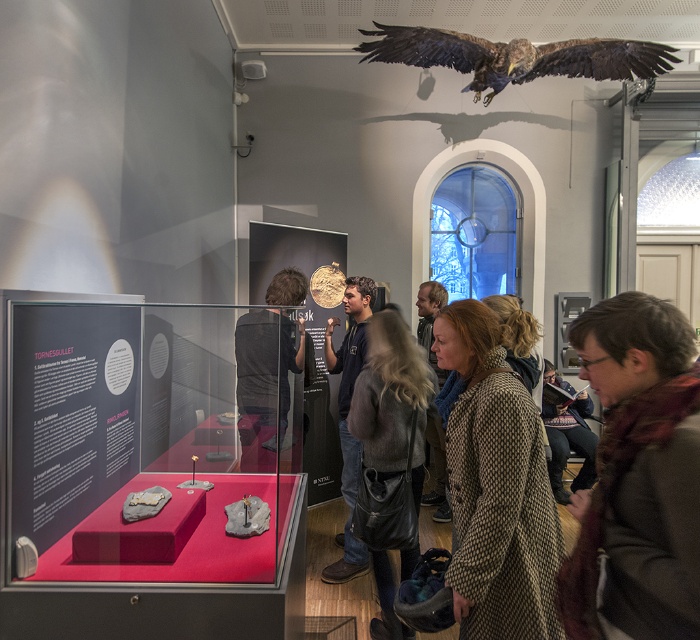
You are a museum visitor who wants to take a photo of both the brown feathered falcon at upper right and the brown wool coat at center. Which object should you zoom in more on to capture its full width in the frame?

The brown feathered falcon at upper right is wider than the brown wool coat at center, so you should zoom in more on the brown wool coat at center to capture its full width in the frame.

In the scene shown: You are a visitor at the museum and want to take a photo of the dark blue jeans at center and the brown wool coat at lower right. Which object should you focus on first if you want to capture both in the same frame without moving your camera?

The brown wool coat at lower right is positioned on the right side of dark blue jeans at center, so you should focus on the dark blue jeans at center first to ensure both are in the frame.